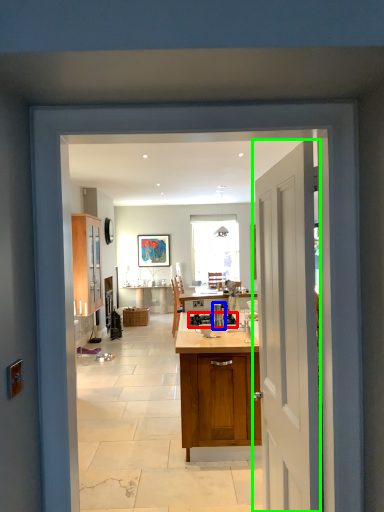
Question: Which object is positioned closest to appliance (highlighted by a red box)? Select from kitchen appliance (highlighted by a blue box) and door (highlighted by a green box).

Choices:
 (A) kitchen appliance
 (B) door

Answer: (A)